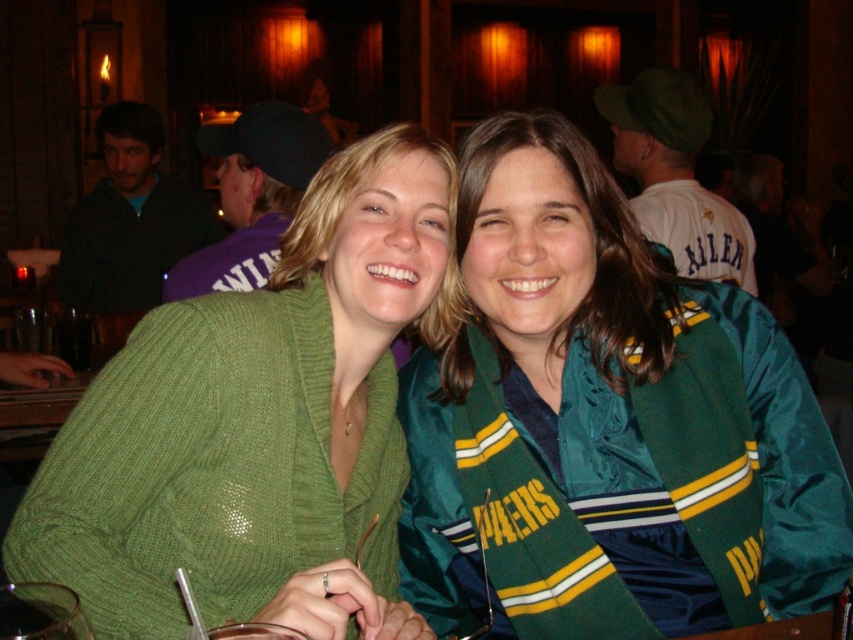
You are a photographer trying to capture a candid shot of the two friends at the center of the image. The green satin jacket at center and the green knitted sweater at center are both in your frame. If your camera has a depth of field that can clearly focus on objects within 10 inches, will both items be in focus?

The green satin jacket at center is 10.07 inches away from the green knitted sweater at center. Since the camera can focus within 10 inches, the distance between them is just over the limit. Therefore, only one of the items will be in focus, not both.

You are a photographer trying to capture a candid shot of both the green satin jacket at center and the green knitted sweater at center. Since the two garments are positioned side by side, which one would you need to focus on first if you want to ensure both are in frame without moving the camera?

The green satin jacket at center is wider than the green knitted sweater at center, so you should focus on the green satin jacket at center first to ensure both garments are fully captured in the frame.

You are standing in the room and want to move from point A to point B. The points are labeled as point A being point [585,490] and point B being point [318,228]. Based on the scene description, which direction should you move to go from point A to point B?

To move from point A to point B, you should move backward because point A is in front of point B, so to reach point B from point A, you need to move in the opposite direction towards the back of the scene.